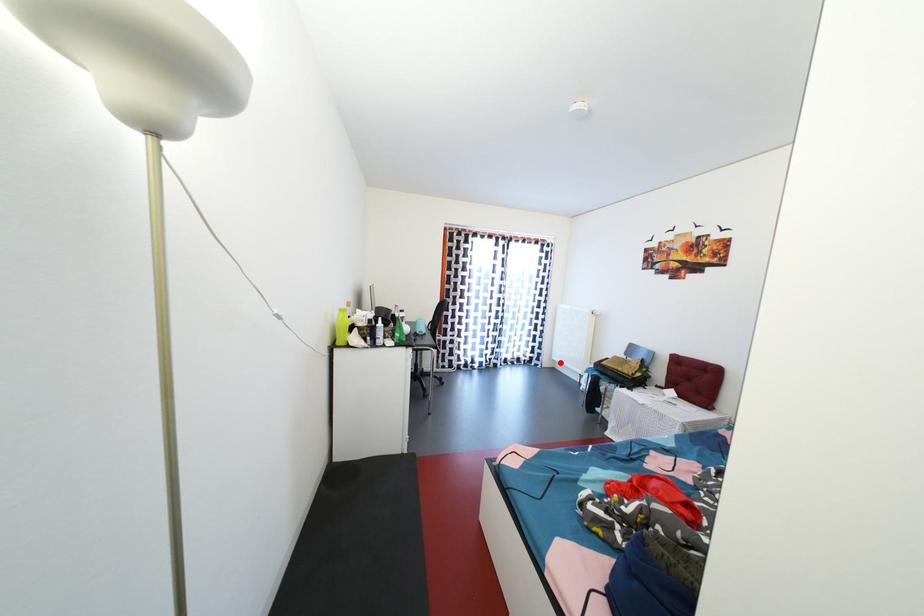
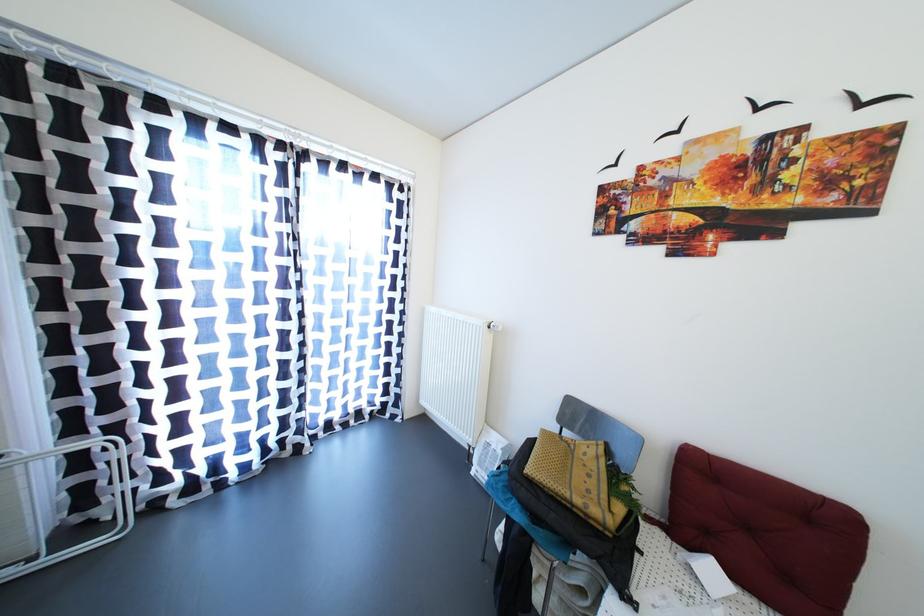
Find the pixel in the second image that matches the highlighted location in the first image.

(430, 407)